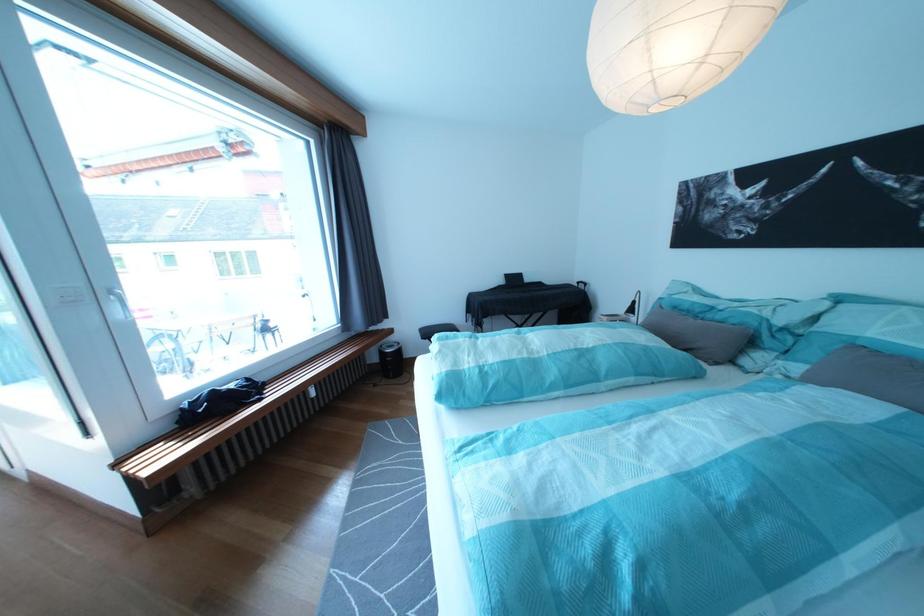
Identify the location of white window handle. (116, 304).